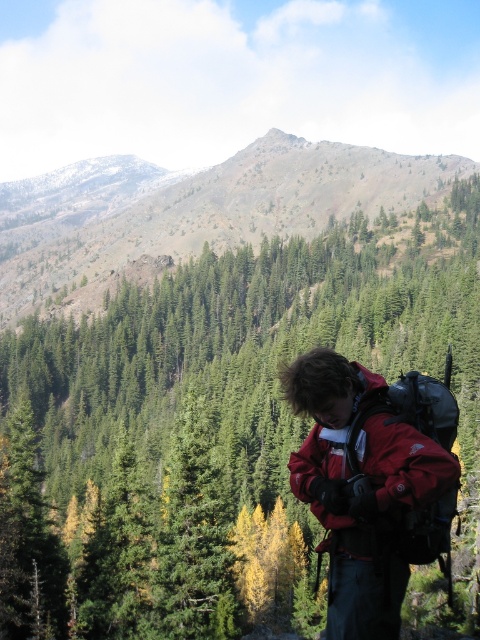
Question: Observing the image, what is the correct spatial positioning of green textured pine tree at center in reference to green textured forest at center?

Choices:
 (A) below
 (B) above

Answer: (A)

Question: Where is green textured forest at center located in relation to matte red jacket at center in the image?

Choices:
 (A) left
 (B) right

Answer: (A)

Question: Which object is the farthest from the matte red jacket at center?

Choices:
 (A) green textured forest at center
 (B) green textured pine tree at center

Answer: (A)

Question: Which point is farther to the camera?

Choices:
 (A) (14, 262)
 (B) (440, 508)

Answer: (A)

Question: Which of the following is the farthest from the observer?

Choices:
 (A) (339, 497)
 (B) (346, 193)

Answer: (B)

Question: Can you confirm if green textured pine tree at center is wider than green textured forest at center?

Choices:
 (A) yes
 (B) no

Answer: (B)